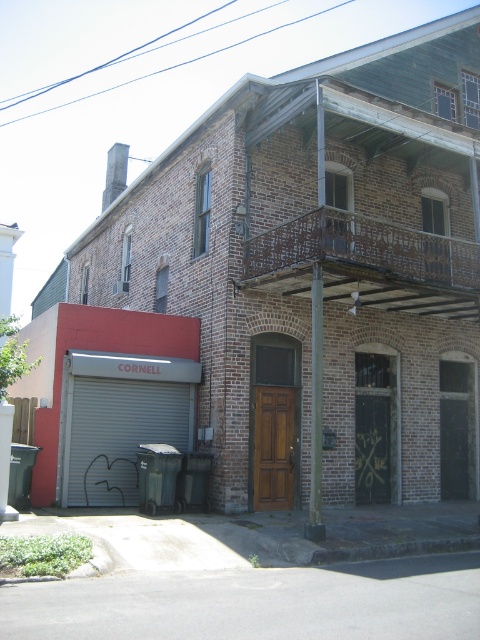
Does gray metallic garage door at lower left have a greater width compared to brown wood door at center?

Yes.

Who is higher up, gray metallic garage door at lower left or brown wood door at center?

gray metallic garage door at lower left

Measure the distance between point (105, 488) and camera.

They are 41.19 feet apart.

Find the location of a particular element. The image size is (480, 640). gray metallic garage door at lower left is located at coordinates (119, 435).

Can you confirm if gray metallic garage door at lower left is smaller than metallic pole at center?

Yes, gray metallic garage door at lower left is smaller than metallic pole at center.

Which is more to the left, gray metallic garage door at lower left or metallic pole at center?

gray metallic garage door at lower left is more to the left.

The height and width of the screenshot is (640, 480). I want to click on gray metallic garage door at lower left, so click(x=119, y=435).

Is brown wood door at center below metallic pole at center?

Yes, brown wood door at center is below metallic pole at center.

Is brown wood door at center shorter than metallic pole at center?

Indeed, brown wood door at center has a lesser height compared to metallic pole at center.

Which is behind, point (285, 481) or point (319, 385)?

The point (285, 481) is more distant.

Where is `brown wood door at center`? brown wood door at center is located at coordinates (273, 448).